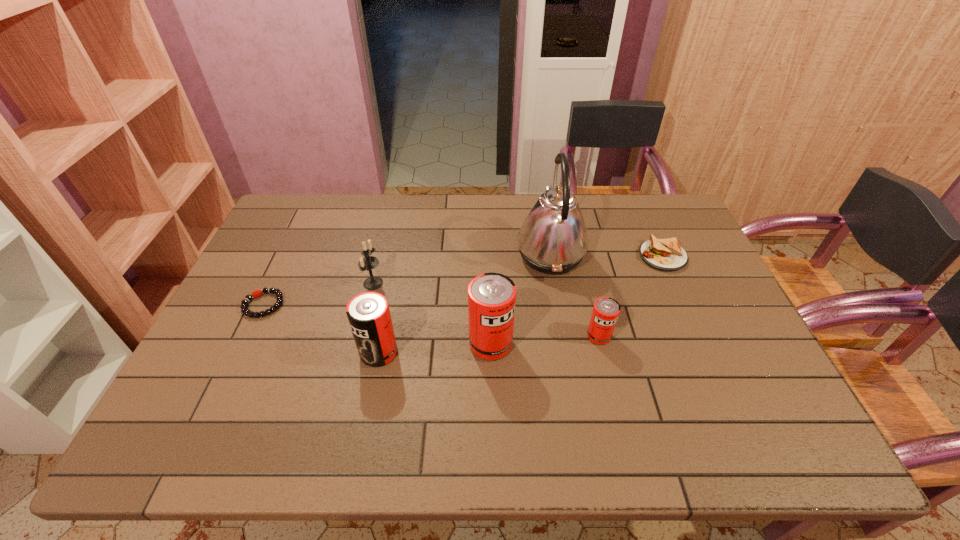
This screenshot has height=540, width=960. In order to click on vacant area between the candle holder and the kettle in this screenshot , I will do `click(462, 269)`.

The height and width of the screenshot is (540, 960). I want to click on vacant space that is in between the second shortest object and the candle holder, so click(517, 270).

The image size is (960, 540). What are the coordinates of `vacant area between the second shortest object and the shortest object` in the screenshot? It's located at (463, 281).

Find the location of a particular element. vacant area that lies between the sixth tallest object and the shortest object is located at coordinates (463, 281).

Identify the location of free area in between the fourth object from left to right and the rightmost can. (545, 340).

Image resolution: width=960 pixels, height=540 pixels. Identify the location of free spot between the second can from right to left and the second tallest can. (435, 348).

Where is `free area in between the shortest object and the leftmost can`? The height and width of the screenshot is (540, 960). free area in between the shortest object and the leftmost can is located at coordinates (321, 328).

This screenshot has height=540, width=960. Identify the location of the closest object to the second shortest can. (368, 262).

At what (x,y) coordinates should I click in order to perform the action: click on object that is the fourth closest one to the sandwich. Please return your answer as a coordinate pair (x, y). The height and width of the screenshot is (540, 960). Looking at the image, I should click on (368, 313).

Identify the location of the second closest can to the second can from left to right. (606, 310).